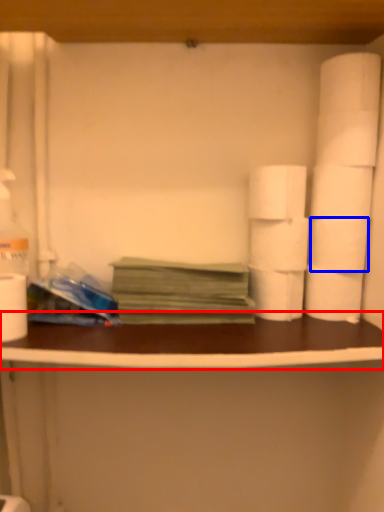
Question: Which of the following is the closest to the observer, counter top (highlighted by a red box) or toilet paper (highlighted by a blue box)?

Choices:
 (A) counter top
 (B) toilet paper

Answer: (A)